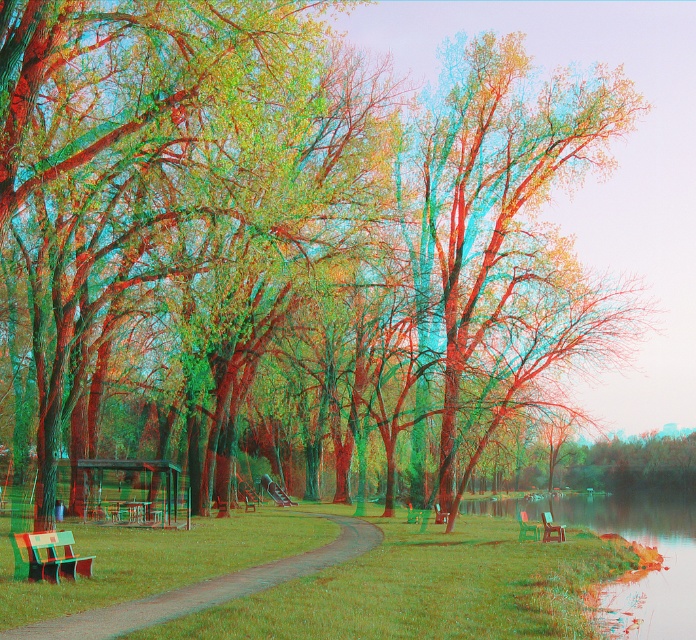
Question: Which object is positioned closest to the wooden park bench at center?

Choices:
 (A) green plastic bench at lower right
 (B) green grassy path at center

Answer: (A)

Question: Where is green grassy path at center located in relation to matte green bench at lower left in the image?

Choices:
 (A) left
 (B) right

Answer: (B)

Question: Which point is farther to the camera?

Choices:
 (A) green grassy path at center
 (B) matte green bench at lower left

Answer: (B)

Question: Which is nearer to the matte green bench at lower left?

Choices:
 (A) wooden park bench at lower right
 (B) wooden park bench at center
 (C) green grassy path at center

Answer: (C)

Question: Is green grassy path at center to the left of matte green bench at lower left from the viewer's perspective?

Choices:
 (A) no
 (B) yes

Answer: (A)

Question: Is green grassy path at center positioned in front of wooden park bench at lower right?

Choices:
 (A) yes
 (B) no

Answer: (A)